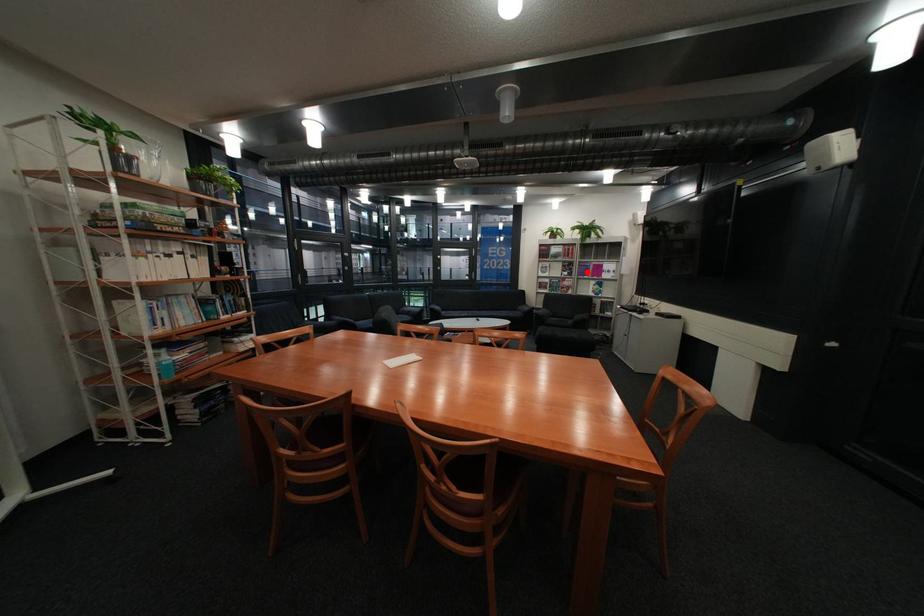
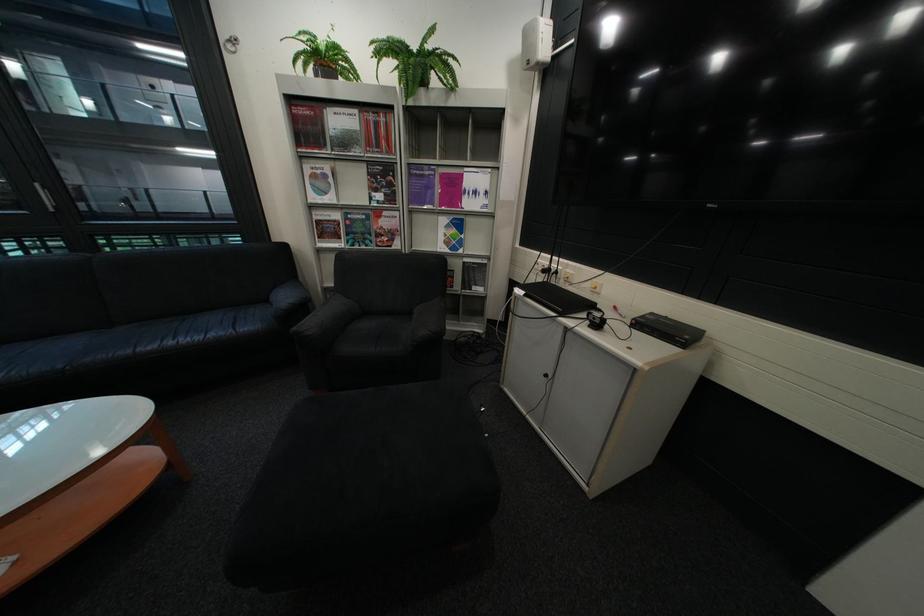
The point at the highlighted location is marked in the first image. Where is the corresponding point in the second image?

(409, 192)